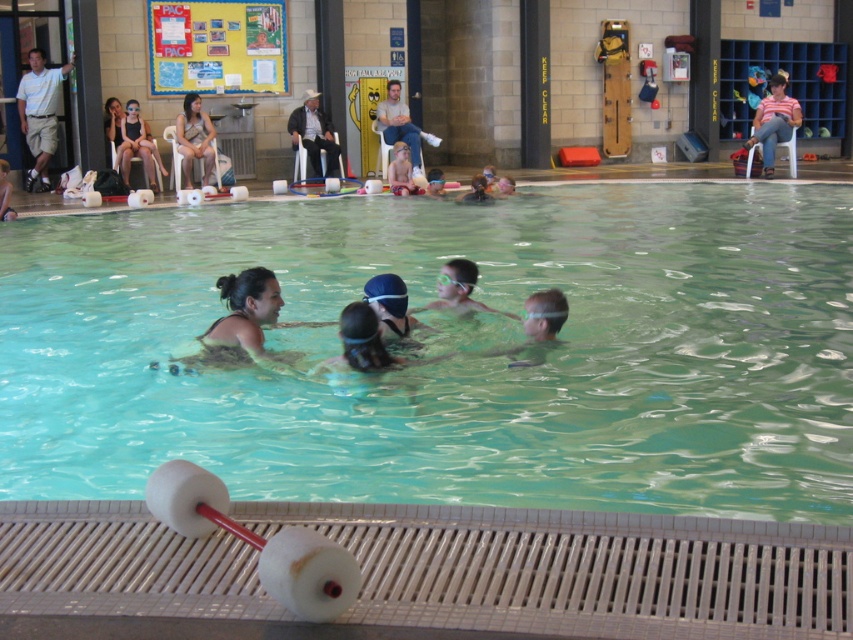
Can you confirm if smooth skin woman at center is shorter than matte beige swimsuit at upper left?

Indeed, smooth skin woman at center has a lesser height compared to matte beige swimsuit at upper left.

Can you confirm if smooth skin woman at center is positioned to the right of matte beige swimsuit at upper left?

Yes, smooth skin woman at center is to the right of matte beige swimsuit at upper left.

The image size is (853, 640). Identify the location of smooth skin woman at center. (242, 321).

Identify the location of smooth skin woman at center. (242, 321).

Between point (245, 356) and point (769, 115), which one is positioned in front?

Point (245, 356)

What do you see at coordinates (242, 321) in the screenshot?
I see `smooth skin woman at center` at bounding box center [242, 321].

What do you see at coordinates (242, 321) in the screenshot?
I see `smooth skin woman at center` at bounding box center [242, 321].

This screenshot has height=640, width=853. What are the coordinates of `smooth skin woman at center` in the screenshot? It's located at coord(242,321).

Who is positioned more to the right, clear plastic pool at center or matte black swim cap at upper center?

From the viewer's perspective, clear plastic pool at center appears more on the right side.

Is clear plastic pool at center above matte black swim cap at upper center?

Incorrect, clear plastic pool at center is not positioned above matte black swim cap at upper center.

You are a GUI agent. You are given a task and a screenshot of the screen. Output one action in this format:
    pyautogui.click(x=<x>, y=<y>)
    Task: Click on the clear plastic pool at center
    This screenshot has height=640, width=853.
    Given the screenshot: What is the action you would take?
    pyautogui.click(x=456, y=358)